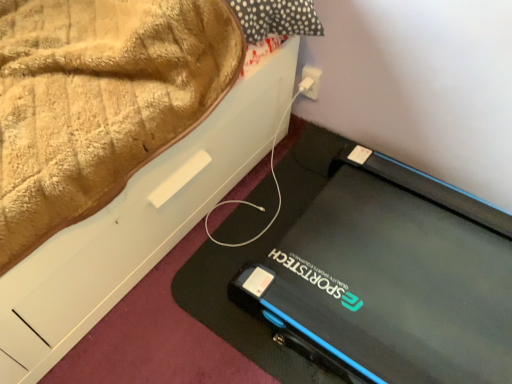
Image resolution: width=512 pixels, height=384 pixels. What do you see at coordinates (138, 223) in the screenshot?
I see `black rubber mat at lower right` at bounding box center [138, 223].

In order to face black rubber mat at lower right, should I rotate leftwards or rightwards?

It's best to rotate left around 0.568 degrees.

The height and width of the screenshot is (384, 512). Identify the location of black rubber mat at lower right. (138, 223).

Find the location of a particular element. This screenshot has height=384, width=512. white plastic plug at upper right is located at coordinates (310, 82).

The height and width of the screenshot is (384, 512). Describe the element at coordinates (310, 82) in the screenshot. I see `white plastic plug at upper right` at that location.

Where is `black rubber mat at lower right`? The width and height of the screenshot is (512, 384). black rubber mat at lower right is located at coordinates (138, 223).

Which object is positioned more to the left, white plastic plug at upper right or black rubber mat at lower right?

black rubber mat at lower right is more to the left.

Is the position of white plastic plug at upper right less distant than that of black rubber mat at lower right?

No, white plastic plug at upper right is further to the viewer.

Does point (308, 66) come farther from viewer compared to point (168, 194)?

Yes.

From the image's perspective, who appears lower, white plastic plug at upper right or black rubber mat at lower right?

black rubber mat at lower right appears lower in the image.

From a real-world perspective, is white plastic plug at upper right over black rubber mat at lower right?

Correct, in the physical world, white plastic plug at upper right is higher than black rubber mat at lower right.

Is white plastic plug at upper right wider than black rubber mat at lower right?

In fact, white plastic plug at upper right might be narrower than black rubber mat at lower right.

Considering the relative sizes of white plastic plug at upper right and black rubber mat at lower right in the image provided, is white plastic plug at upper right taller than black rubber mat at lower right?

Correct, white plastic plug at upper right is much taller as black rubber mat at lower right.

Who is bigger, white plastic plug at upper right or black rubber mat at lower right?

Bigger between the two is black rubber mat at lower right.

From the picture: Would you say white plastic plug at upper right is outside black rubber mat at lower right?

Absolutely, white plastic plug at upper right is external to black rubber mat at lower right.

Is white plastic plug at upper right far away from black rubber mat at lower right?

white plastic plug at upper right is actually quite close to black rubber mat at lower right.

In the scene shown: Is white plastic plug at upper right oriented away from black rubber mat at lower right?

No.

Can you tell me how much white plastic plug at upper right and black rubber mat at lower right differ in facing direction?

white plastic plug at upper right and black rubber mat at lower right are facing 88.2 degrees away from each other.

What are the coordinates of `furniture located below the white plastic plug at upper right (from the image's perspective)` in the screenshot? It's located at (138, 223).

Is black rubber mat at lower right at the left side of white plastic plug at upper right?

Yes.

Does black rubber mat at lower right come behind white plastic plug at upper right?

No, black rubber mat at lower right is closer to the viewer.

Which is less distant, (x=54, y=270) or (x=310, y=93)?

Positioned in front is point (x=54, y=270).

From the image's perspective, is black rubber mat at lower right on top of white plastic plug at upper right?

No.

From a real-world perspective, does black rubber mat at lower right sit lower than white plastic plug at upper right?

Yes, from a real-world perspective, black rubber mat at lower right is below white plastic plug at upper right.

Considering the sizes of black rubber mat at lower right and white plastic plug at upper right in the image, is black rubber mat at lower right wider or thinner than white plastic plug at upper right?

In the image, black rubber mat at lower right appears to be wider than white plastic plug at upper right.

Considering the sizes of objects black rubber mat at lower right and white plastic plug at upper right in the image provided, who is taller, black rubber mat at lower right or white plastic plug at upper right?

Standing taller between the two is white plastic plug at upper right.

Considering the sizes of objects black rubber mat at lower right and white plastic plug at upper right in the image provided, who is smaller, black rubber mat at lower right or white plastic plug at upper right?

With smaller size is white plastic plug at upper right.

Can white plastic plug at upper right be found inside black rubber mat at lower right?

Actually, white plastic plug at upper right is outside black rubber mat at lower right.

Is black rubber mat at lower right beside white plastic plug at upper right?

black rubber mat at lower right is not next to white plastic plug at upper right, and they're not touching.

Is black rubber mat at lower right facing away from white plastic plug at upper right?

That's not correct — black rubber mat at lower right is not looking away from white plastic plug at upper right.

How many degrees apart are the facing directions of black rubber mat at lower right and white plastic plug at upper right?

The angular difference between black rubber mat at lower right and white plastic plug at upper right is 88.2 degrees.

Where is `electric outlet above the black rubber mat at lower right (from the image's perspective)`? The width and height of the screenshot is (512, 384). electric outlet above the black rubber mat at lower right (from the image's perspective) is located at coordinates (310, 82).

Where is `furniture on the left of white plastic plug at upper right`? The image size is (512, 384). furniture on the left of white plastic plug at upper right is located at coordinates (138, 223).

Locate an element on the screen. This screenshot has width=512, height=384. furniture in front of the white plastic plug at upper right is located at coordinates (138, 223).